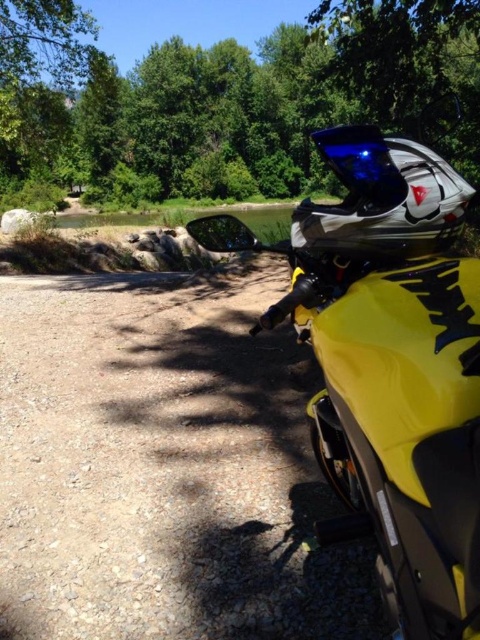
Question: Can you confirm if yellow matte dirt track at center is wider than green leafy tree at upper center?

Choices:
 (A) yes
 (B) no

Answer: (B)

Question: Does yellow matte dirt track at center have a lesser width compared to green leafy tree at upper center?

Choices:
 (A) yes
 (B) no

Answer: (A)

Question: Is yellow matte dirt track at center closer to the viewer compared to green leafy tree at upper center?

Choices:
 (A) yes
 (B) no

Answer: (A)

Question: Which of the following is the closest to the observer?

Choices:
 (A) yellow matte dirt track at center
 (B) green leafy tree at upper center

Answer: (A)